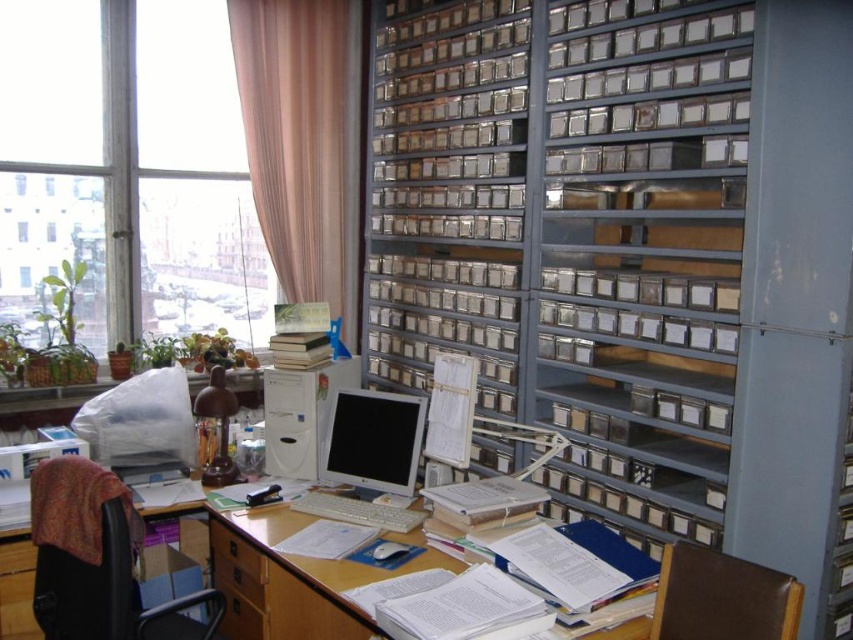
Can you confirm if wooden desk at center is positioned below white plastic desktop computer at center?

Yes.

Based on the photo, between wooden desk at center and white plastic desktop computer at center, which one is positioned higher?

white plastic desktop computer at center

Describe the element at coordinates (474, 536) in the screenshot. The height and width of the screenshot is (640, 853). I see `wooden desk at center` at that location.

Where is `wooden desk at center`? The width and height of the screenshot is (853, 640). wooden desk at center is located at coordinates (474, 536).

In the scene shown: Does white plastic desktop computer at center have a smaller size compared to brown wood drawer at lower left?

Actually, white plastic desktop computer at center might be larger than brown wood drawer at lower left.

Does point (311, 460) come closer to viewer compared to point (242, 556)?

No.

Identify the location of white plastic desktop computer at center. (300, 416).

Between point (268, 205) and point (296, 417), which one is positioned in front?

Point (296, 417)

Does point (245, 102) come in front of point (276, 412)?

No.

The height and width of the screenshot is (640, 853). I want to click on pink fabric curtain at upper left, so click(x=303, y=140).